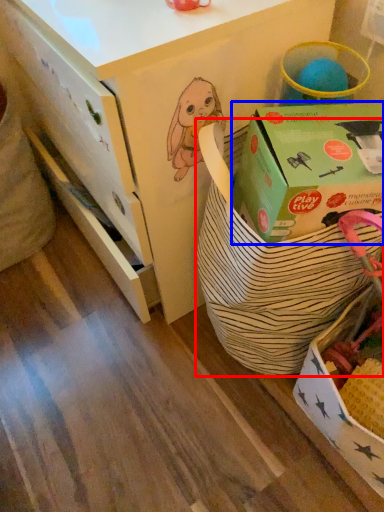
Question: Which of the following is the closest to the observer, gift basket (highlighted by a red box) or box (highlighted by a blue box)?

Choices:
 (A) gift basket
 (B) box

Answer: (A)